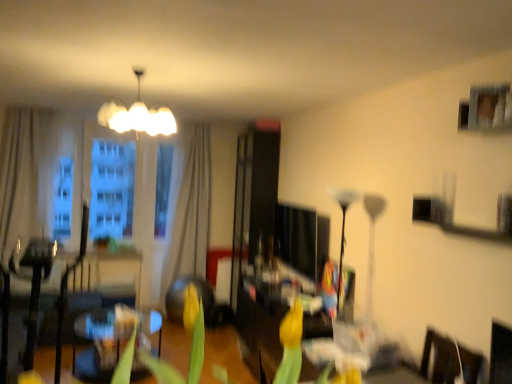
Question: From the image's perspective, would you say dark brown leather armchair at left is shown under white glossy chandelier at upper center, the 1th lamp from the top?

Choices:
 (A) yes
 (B) no

Answer: (A)

Question: Is dark brown leather armchair at left wider than white glossy chandelier at upper center, which appears as the 2th lamp when ordered from the bottom?

Choices:
 (A) yes
 (B) no

Answer: (A)

Question: From a real-world perspective, is dark brown leather armchair at left physically above white glossy chandelier at upper center, which appears as the 2th lamp when ordered from the bottom?

Choices:
 (A) no
 (B) yes

Answer: (A)

Question: Is white glossy chandelier at upper center, the 1th lamp positioned from the left, completely or partially inside dark brown leather armchair at left?

Choices:
 (A) yes
 (B) no

Answer: (B)

Question: Is dark brown leather armchair at left outside white glossy chandelier at upper center, which appears as the 2th lamp when viewed from the right?

Choices:
 (A) no
 (B) yes

Answer: (B)

Question: Is white fabric curtain at center, arranged as the first curtain when viewed from the back, wider or thinner than dark brown leather armchair at left?

Choices:
 (A) wide
 (B) thin

Answer: (B)

Question: From the image's perspective, is white fabric curtain at center, the 2th curtain positioned from the front, above or below dark brown leather armchair at left?

Choices:
 (A) above
 (B) below

Answer: (A)

Question: In the image, is white fabric curtain at center, the 2th curtain positioned from the front, on the left side or the right side of dark brown leather armchair at left?

Choices:
 (A) right
 (B) left

Answer: (A)

Question: Considering their positions, is white fabric curtain at center, arranged as the first curtain when viewed from the back, located in front of or behind dark brown leather armchair at left?

Choices:
 (A) front
 (B) behind

Answer: (B)

Question: Is beige fabric curtain at left, the 1th curtain from the front, inside the boundaries of yellow matte tulip at center, or outside?

Choices:
 (A) outside
 (B) inside

Answer: (A)

Question: Considering the positions of beige fabric curtain at left, the 1th curtain from the front, and yellow matte tulip at center in the image, is beige fabric curtain at left, the 1th curtain from the front, wider or thinner than yellow matte tulip at center?

Choices:
 (A) thin
 (B) wide

Answer: (B)

Question: From the image's perspective, relative to yellow matte tulip at center, is beige fabric curtain at left, the 1th curtain from the front, above or below?

Choices:
 (A) below
 (B) above

Answer: (B)

Question: Is beige fabric curtain at left, the second curtain positioned from the back, in front of or behind yellow matte tulip at center in the image?

Choices:
 (A) front
 (B) behind

Answer: (B)

Question: Considering the positions of point (192, 150) and point (339, 266), is point (192, 150) closer or farther from the camera than point (339, 266)?

Choices:
 (A) closer
 (B) farther

Answer: (B)

Question: Considering the positions of white fabric curtain at center, arranged as the first curtain when viewed from the back, and black glass floor lamp at center, which is the 2th lamp from left to right, in the image, is white fabric curtain at center, arranged as the first curtain when viewed from the back, wider or thinner than black glass floor lamp at center, which is the 2th lamp from left to right,?

Choices:
 (A) thin
 (B) wide

Answer: (B)